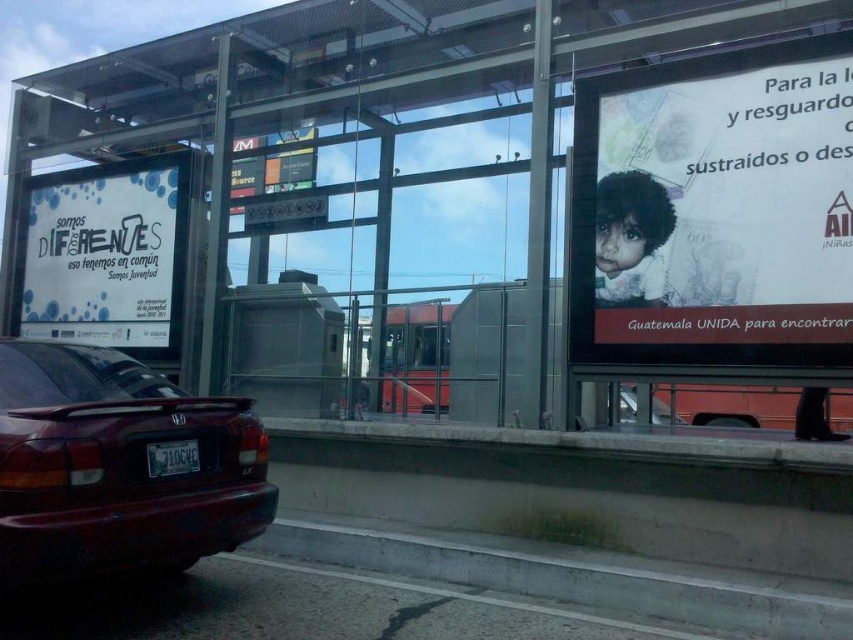
Question: Can you confirm if white paper billboard at left is positioned to the right of metallic silver car at lower right?

Choices:
 (A) yes
 (B) no

Answer: (B)

Question: Is white glossy poster at upper right thinner than metallic silver car at lower right?

Choices:
 (A) yes
 (B) no

Answer: (A)

Question: Among these objects, which one is farthest from the camera?

Choices:
 (A) white glossy poster at upper right
 (B) metallic silver car at lower right

Answer: (B)

Question: Which of the following is the farthest from the observer?

Choices:
 (A) matte digital display at center
 (B) white glossy poster at upper right

Answer: (A)

Question: Which object is the farthest from the matte digital display at center?

Choices:
 (A) white glossy poster at upper right
 (B) white paper billboard at left
 (C) glossy red car at lower left

Answer: (A)

Question: Can you confirm if white glossy poster at upper right is bigger than glossy red car at lower left?

Choices:
 (A) no
 (B) yes

Answer: (B)